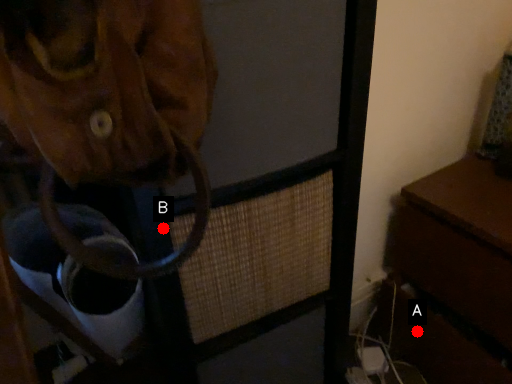
Question: Two points are circled on the image, labeled by A and B beside each circle. Which point is further to the camera?

Choices:
 (A) A is further
 (B) B is further

Answer: (A)